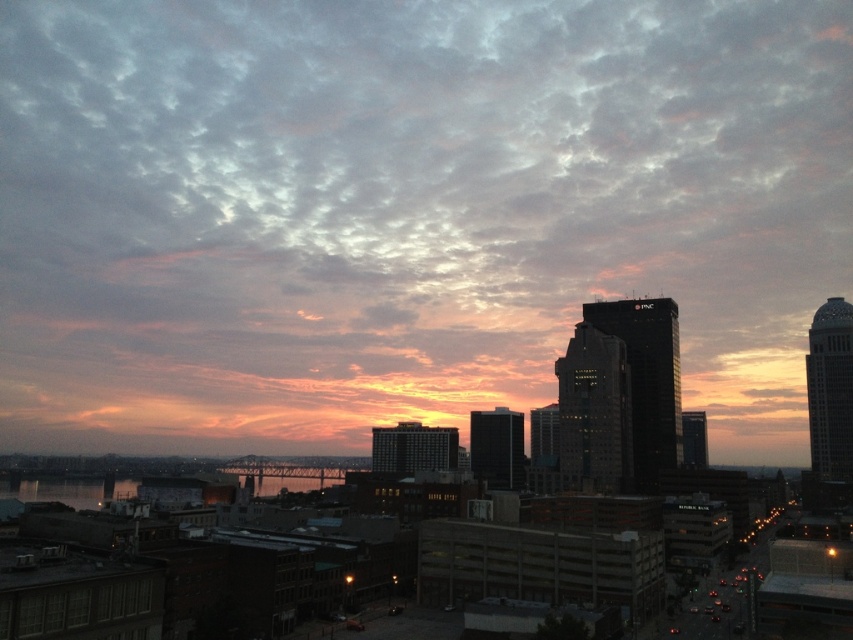
Who is positioned more to the left, cloudy sky at upper center or reflective glass water at center?

Positioned to the left is reflective glass water at center.

Is cloudy sky at upper center positioned in front of reflective glass water at center?

No, cloudy sky at upper center is behind reflective glass water at center.

Measure the distance between cloudy sky at upper center and camera.

cloudy sky at upper center and camera are 316.94 meters apart.

This screenshot has height=640, width=853. I want to click on cloudy sky at upper center, so [405, 211].